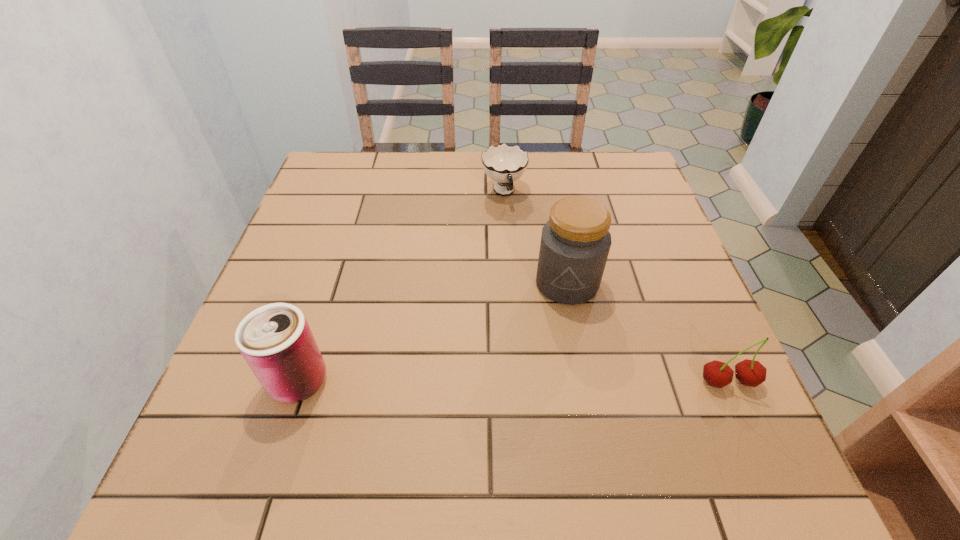
Where is `free area in between the tallest object and the farthest object`? The image size is (960, 540). free area in between the tallest object and the farthest object is located at coordinates (536, 238).

Image resolution: width=960 pixels, height=540 pixels. I want to click on blank region between the cherry and the third shortest object, so click(x=514, y=381).

You are a GUI agent. You are given a task and a screenshot of the screen. Output one action in this format:
    pyautogui.click(x=<x>, y=<y>)
    Task: Click on the free spot between the third tallest object and the jar
    This screenshot has width=960, height=540.
    Given the screenshot: What is the action you would take?
    pyautogui.click(x=648, y=333)

I want to click on unoccupied area between the can and the tallest object, so click(433, 332).

The width and height of the screenshot is (960, 540). Identify the location of free space between the can and the rightmost object. tap(514, 381).

Locate an element on the screen. free space that is in between the jar and the farthest object is located at coordinates (536, 238).

Where is `empty location between the cup and the rightmost object`? The image size is (960, 540). empty location between the cup and the rightmost object is located at coordinates (616, 287).

This screenshot has height=540, width=960. I want to click on empty space between the second shortest object and the shortest object, so click(616, 287).

You are a GUI agent. You are given a task and a screenshot of the screen. Output one action in this format:
    pyautogui.click(x=<x>, y=<y>)
    Task: Click on the object that stands as the closest to the second tallest object
    
    Given the screenshot: What is the action you would take?
    pyautogui.click(x=575, y=242)

I want to click on object that is the second closest to the farthest object, so click(x=275, y=340).